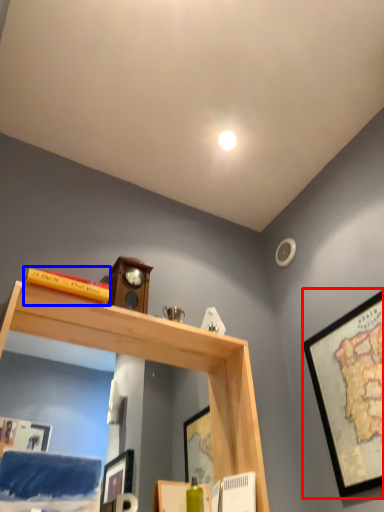
Question: Which of the following is the farthest to the observer, picture frame (highlighted by a red box) or book (highlighted by a blue box)?

Choices:
 (A) picture frame
 (B) book

Answer: (B)